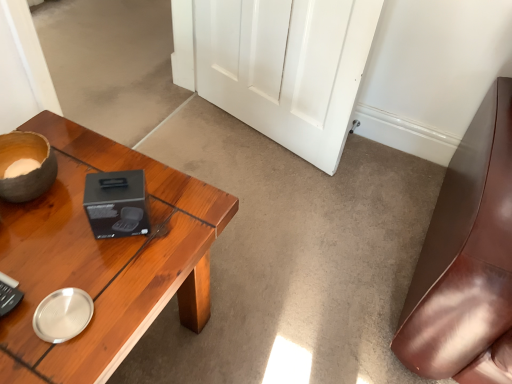
This screenshot has width=512, height=384. I want to click on empty space that is to the right of wooden desk at left, so click(284, 305).